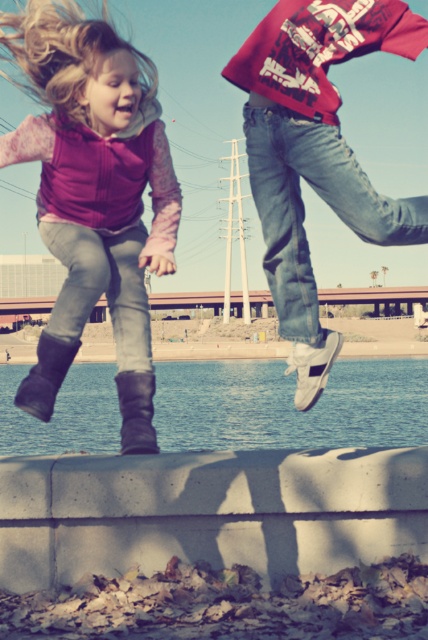
Question: Does matte pink vest at upper left appear under blue water at lower center?

Choices:
 (A) yes
 (B) no

Answer: (B)

Question: Is matte pink vest at upper left above blue water at lower center?

Choices:
 (A) no
 (B) yes

Answer: (B)

Question: Which point appears farthest from the camera in this image?

Choices:
 (A) (39, 221)
 (B) (199, 401)

Answer: (B)

Question: Observing the image, what is the correct spatial positioning of matte pink vest at upper left in reference to blue water at lower center?

Choices:
 (A) left
 (B) right

Answer: (B)